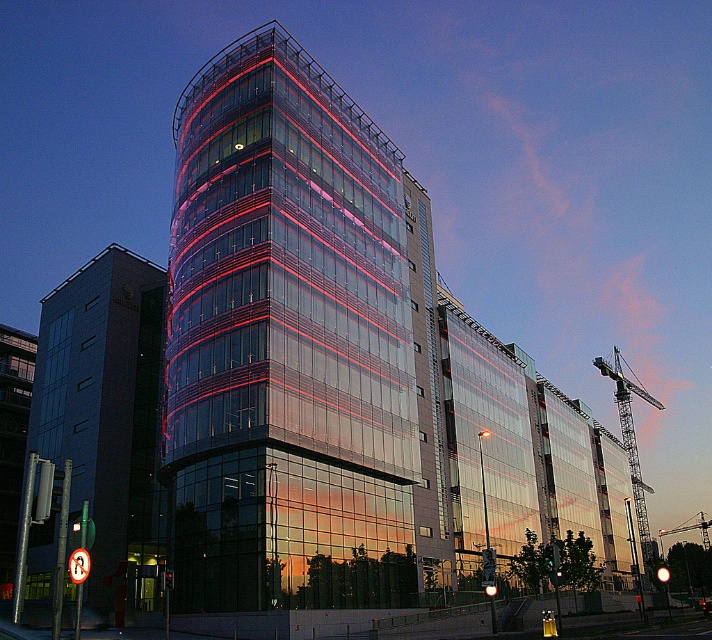
Question: Which of the following is the closest to the observer?

Choices:
 (A) (703, 544)
 (B) (629, 458)
 (C) (231, 179)

Answer: (C)

Question: Does dark glass building at left have a smaller size compared to metallic construction crane at right?

Choices:
 (A) no
 (B) yes

Answer: (A)

Question: Which point is closer to the camera?

Choices:
 (A) (75, 497)
 (B) (258, 106)

Answer: (B)

Question: Among these points, which one is nearest to the camera?

Choices:
 (A) (286, 564)
 (B) (671, 531)
 (C) (136, 374)

Answer: (A)

Question: Where is transparent glass building at center located in relation to metallic gray crane at right in the image?

Choices:
 (A) left
 (B) right

Answer: (A)

Question: Where is dark glass building at left located in relation to metallic construction crane at right in the image?

Choices:
 (A) below
 (B) above

Answer: (B)